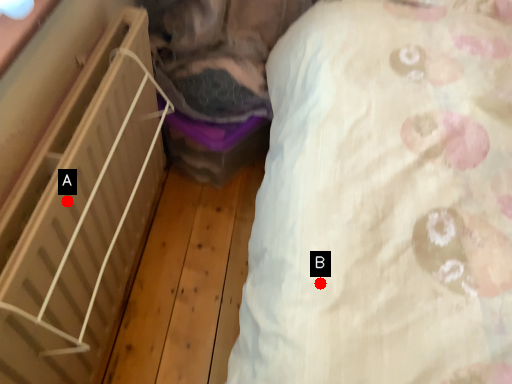
Question: Two points are circled on the image, labeled by A and B beside each circle. Which point is farther to the camera?

Choices:
 (A) A is further
 (B) B is further

Answer: (A)